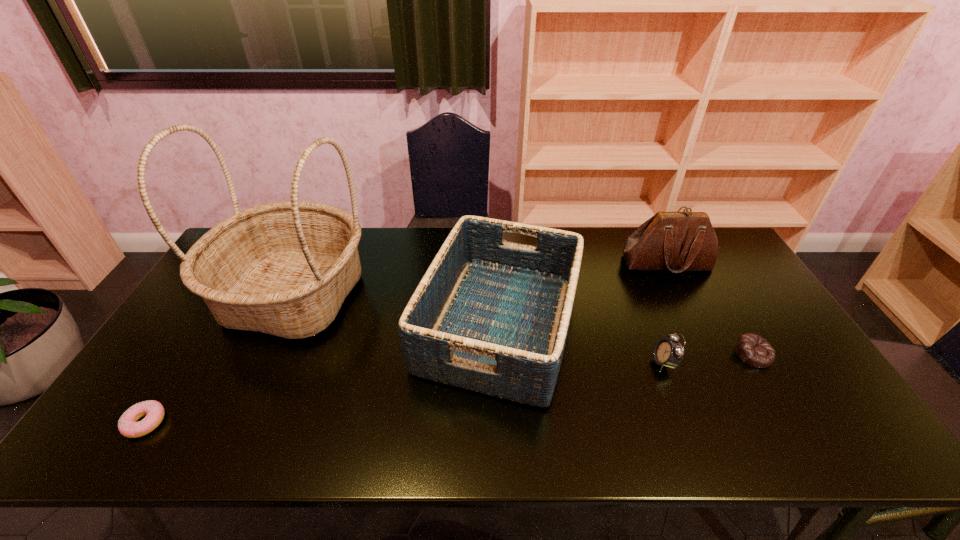
Image resolution: width=960 pixels, height=540 pixels. Find the location of `shoulder bag present at the right edge`. shoulder bag present at the right edge is located at coordinates (677, 241).

You are a GUI agent. You are given a task and a screenshot of the screen. Output one action in this format:
    pyautogui.click(x=<x>, y=<y>)
    Task: Click on the beanbag positioned at the right edge
    This screenshot has width=960, height=540.
    Given the screenshot: What is the action you would take?
    pyautogui.click(x=752, y=349)

The image size is (960, 540). In order to click on object that is at the far left corner in this screenshot , I will do [284, 268].

Locate an element on the screen. The width and height of the screenshot is (960, 540). object situated at the near left corner is located at coordinates (128, 426).

Find the location of a particular element. The width and height of the screenshot is (960, 540). object that is at the far right corner is located at coordinates (677, 241).

Find the location of a particular element. The height and width of the screenshot is (540, 960). blank space at the far edge of the desktop is located at coordinates (613, 252).

Image resolution: width=960 pixels, height=540 pixels. Find the location of `blank area at the near edge`. blank area at the near edge is located at coordinates (424, 444).

Where is `free location at the far right corner of the desktop`? free location at the far right corner of the desktop is located at coordinates (723, 249).

Locate an element on the screen. The width and height of the screenshot is (960, 540). free point between the shortest object and the shorter basket is located at coordinates (323, 374).

At what (x,y) coordinates should I click in order to perform the action: click on free space between the shortest object and the right basket. Please return your answer as a coordinate pair (x, y). Looking at the image, I should click on (323, 374).